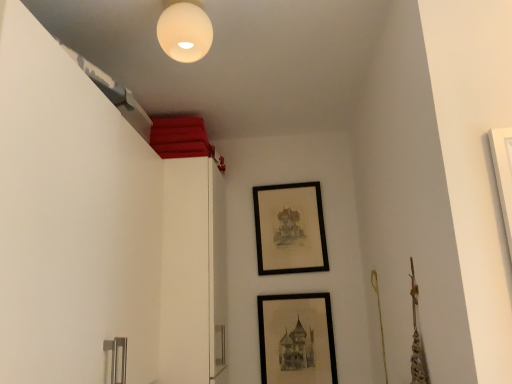
Question: From the image's perspective, is black matte picture frame at upper center, marked as the 1th picture frame in a top-to-bottom arrangement, positioned above or below white matte sphere at upper center?

Choices:
 (A) above
 (B) below

Answer: (B)

Question: Is black matte picture frame at upper center, which is the first picture frame in back-to-front order, inside or outside of white matte sphere at upper center?

Choices:
 (A) inside
 (B) outside

Answer: (B)

Question: Which of these objects is positioned farthest from the black matte picture frame at lower center, which appears as the second picture frame when viewed from the top?

Choices:
 (A) white matte sphere at upper center
 (B) black matte picture frame at upper center, which is the first picture frame in back-to-front order

Answer: (A)

Question: Which is nearer to the black matte picture frame at lower center, which is the first picture frame in bottom-to-top order?

Choices:
 (A) white matte sphere at upper center
 (B) black matte picture frame at upper center, which is the first picture frame in back-to-front order

Answer: (B)